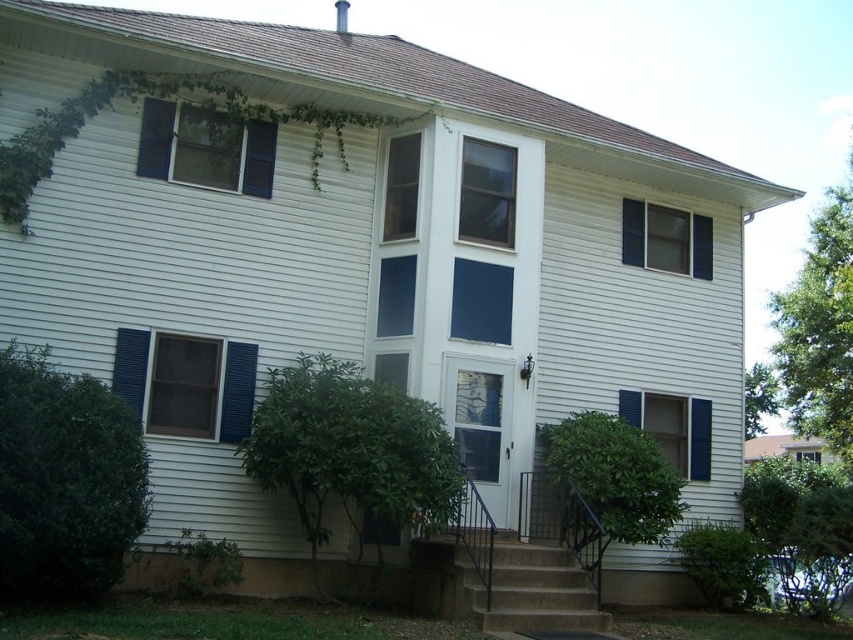
You are standing in front of the residential building and want to determine the relative positions of two points marked on the wall. Which point, point (521, 545) or point (654, 432), is closer to you?

Point (521, 545) is closer to the viewer than point (654, 432).

You are a window installer assessing the building. You need to replace the blue painted wood window at upper right and the blue painted wood shutter at left. Which object should you work on first considering their spatial relationship?

The blue painted wood shutter at left is behind the blue painted wood window at upper right, so you should work on the window first before accessing the shutter behind it.

You are a delivery person with a 2.5 meter long package that needs to be carried through the path between the matte blue shutters at left and the brown concrete stairs at center. Can you carry the package through that path without tilting it?

The distance between the matte blue shutters at left and the brown concrete stairs at center is 3.76 meters, so yes, the 2.5 meter long package can be carried through the path without tilting it since the path is longer than the package.